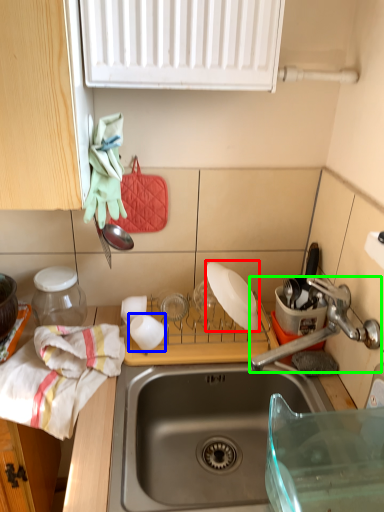
Question: Which object is positioned closest to appliance (highlighted by a red box)? Select from tableware (highlighted by a blue box) and tap (highlighted by a green box).

Choices:
 (A) tableware
 (B) tap

Answer: (B)